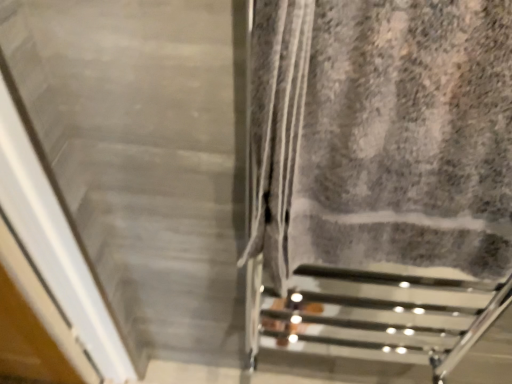
What are the coordinates of `gray textured towel at right` in the screenshot? It's located at (382, 134).

In order to face gray textured towel at right, should I rotate leftwards or rightwards?

A 19.006 degree turn to the right will do.

What do you see at coordinates (382, 134) in the screenshot?
I see `gray textured towel at right` at bounding box center [382, 134].

The height and width of the screenshot is (384, 512). I want to click on gray textured towel at right, so click(x=382, y=134).